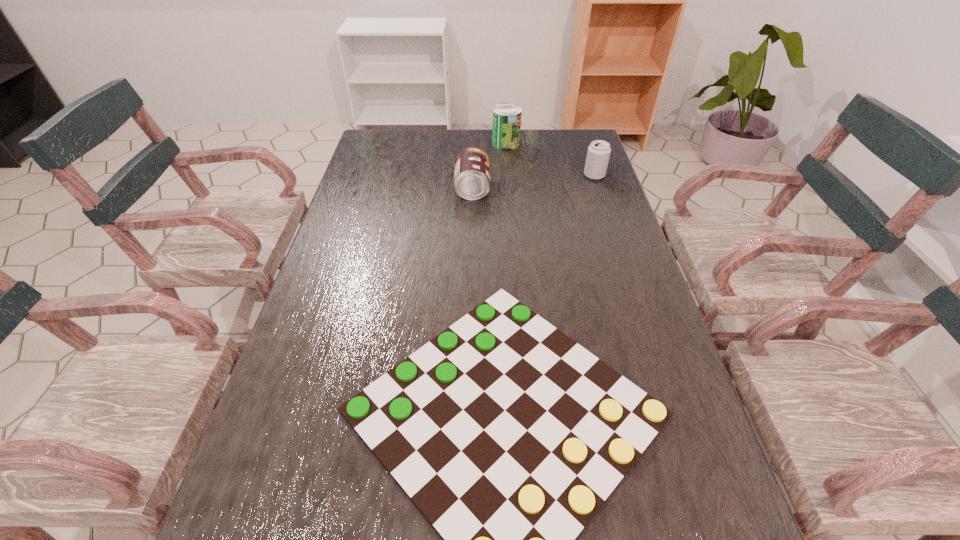
At what (x,y) coordinates should I click in order to perform the action: click on free region at the left edge of the desktop. Please return your answer as a coordinate pair (x, y). This screenshot has height=540, width=960. Looking at the image, I should click on (275, 437).

The width and height of the screenshot is (960, 540). I want to click on blank space at the right edge, so click(x=582, y=233).

At what (x,y) coordinates should I click in order to perform the action: click on vacant region at the far left corner of the desktop. Please return your answer as a coordinate pair (x, y). Image resolution: width=960 pixels, height=540 pixels. Looking at the image, I should click on (393, 130).

This screenshot has height=540, width=960. I want to click on vacant area at the far right corner of the desktop, so point(573,132).

Image resolution: width=960 pixels, height=540 pixels. I want to click on free spot between the rightmost can and the leftmost can, so click(534, 181).

You are a GUI agent. You are given a task and a screenshot of the screen. Output one action in this format:
    pyautogui.click(x=<x>, y=<y>)
    Task: Click on the free point between the leftmost can and the rightmost can
    The height and width of the screenshot is (540, 960).
    Given the screenshot: What is the action you would take?
    point(534,181)

Locate an element on the screen. vacant space in between the leftmost can and the rightmost can is located at coordinates (534, 181).

Identify the location of free area in between the rightmost can and the second can from right to left. This screenshot has height=540, width=960. (550, 159).

Find the location of a particular element. vacant space that's between the second can from right to left and the rightmost can is located at coordinates (550, 159).

Locate an element on the screen. the second closest object to the leftmost can is located at coordinates (598, 154).